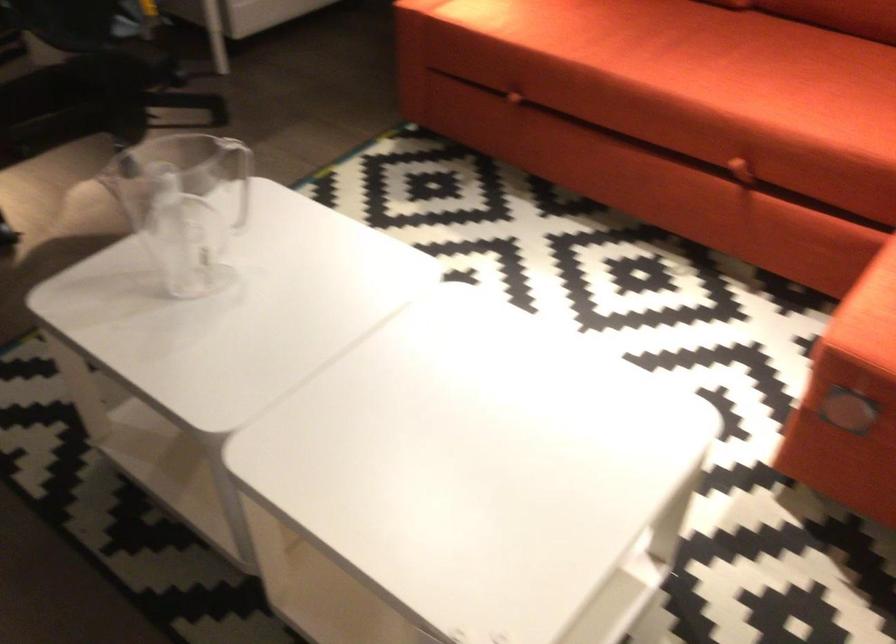
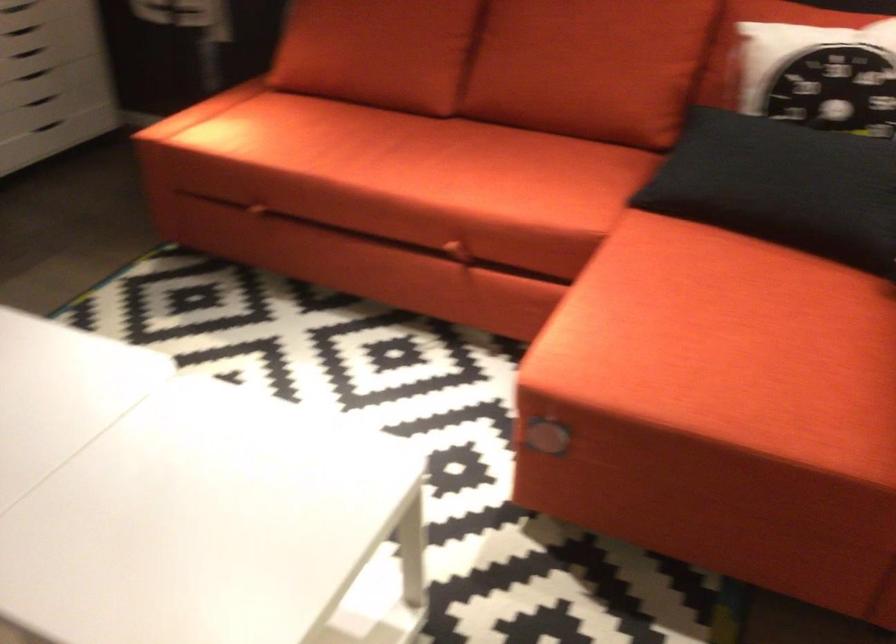
What movement of the cameraman would produce the second image?

The cameraman moved toward right, backward.